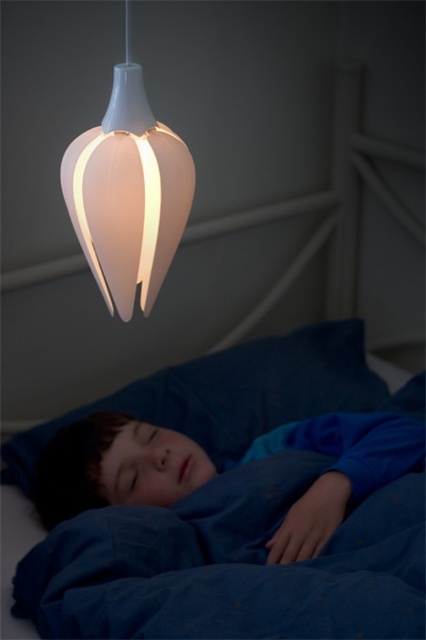
Does blue soft fabric at lower center come in front of blue fabric pillow at lower center?

Result: Yes, it is in front of blue fabric pillow at lower center.

Does blue soft fabric at lower center have a greater height compared to blue fabric pillow at lower center?

Incorrect, blue soft fabric at lower center's height is not larger of blue fabric pillow at lower center's.

This screenshot has height=640, width=426. In order to click on blue soft fabric at lower center in this screenshot , I will do `click(117, 467)`.

I want to click on blue fabric pillow at lower center, so click(x=232, y=394).

The width and height of the screenshot is (426, 640). Describe the element at coordinates (232, 394) in the screenshot. I see `blue fabric pillow at lower center` at that location.

Where is `blue fabric pillow at lower center`? The width and height of the screenshot is (426, 640). blue fabric pillow at lower center is located at coordinates (232, 394).

You are a GUI agent. You are given a task and a screenshot of the screen. Output one action in this format:
    pyautogui.click(x=<x>, y=<y>)
    Task: Click on the blue soft fabric at lower center
    
    Given the screenshot: What is the action you would take?
    pyautogui.click(x=117, y=467)

Based on the photo, is blue soft fabric at lower center further to the viewer compared to white matte lampshade at upper center?

Yes, it is behind white matte lampshade at upper center.

At what (x,y) coordinates should I click in order to perform the action: click on blue soft fabric at lower center. Please return your answer as a coordinate pair (x, y). The width and height of the screenshot is (426, 640). Looking at the image, I should click on (117, 467).